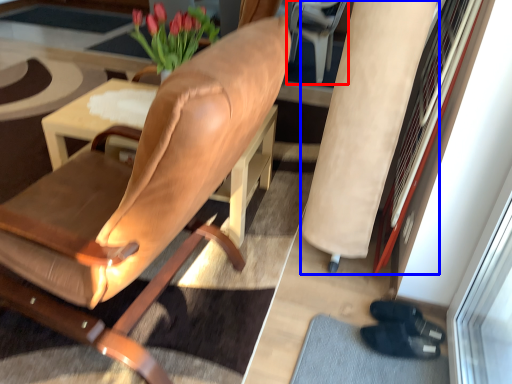
Question: Which of the following is the closest to the observer, armchair (highlighted by a red box) or beige (highlighted by a blue box)?

Choices:
 (A) armchair
 (B) beige

Answer: (B)